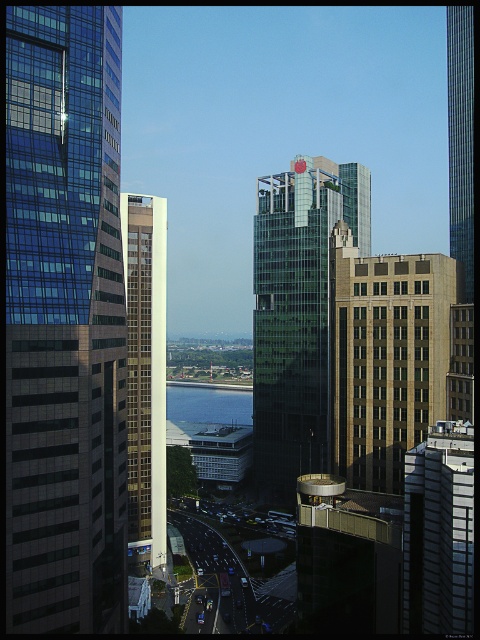
Question: Which of the following is the closest to the observer?

Choices:
 (A) (453, 620)
 (B) (223, 403)
 (C) (464, 92)

Answer: (A)

Question: Considering the real-world distances, which object is farthest from the white glass tower at center?

Choices:
 (A) blue glass water at center
 (B) glassy reflective skyscraper at left
 (C) brown brick building at center
 (D) white glossy building at center-right

Answer: (A)

Question: Is white glass tower at center to the left of glassy reflective skyscraper at center from the viewer's perspective?

Choices:
 (A) yes
 (B) no

Answer: (A)

Question: Which point is farther to the camera?

Choices:
 (A) blue glass water at center
 (B) glassy reflective skyscraper at center
 (C) white glass tower at center
 (D) glassy skyscraper at right

Answer: (A)

Question: Is brown brick building at center to the left of blue glass water at center from the viewer's perspective?

Choices:
 (A) no
 (B) yes

Answer: (A)

Question: Does white glass tower at center have a smaller size compared to white glossy building at center-right?

Choices:
 (A) yes
 (B) no

Answer: (B)